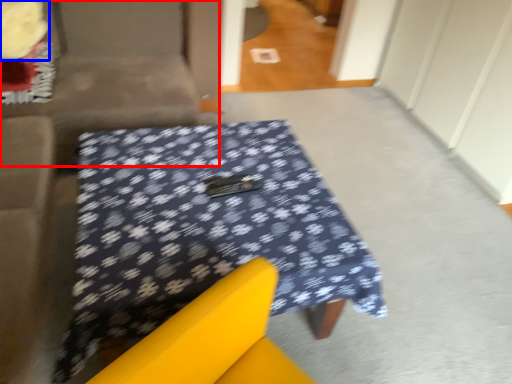
Question: Among these objects, which one is farthest to the camera, couch (highlighted by a red box) or flower (highlighted by a blue box)?

Choices:
 (A) couch
 (B) flower

Answer: (B)